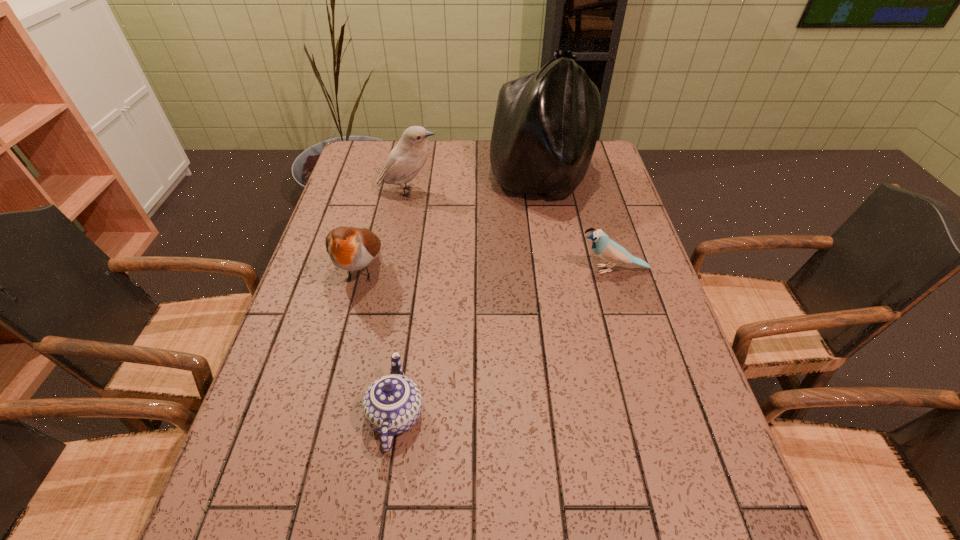
Locate an element on the screen. The height and width of the screenshot is (540, 960). blank region between the farthest bird and the chinaware is located at coordinates (402, 303).

Image resolution: width=960 pixels, height=540 pixels. What are the coordinates of `vacant space that's between the farthest bird and the second shortest bird` in the screenshot? It's located at (385, 231).

Locate an element on the screen. The height and width of the screenshot is (540, 960). vacant space that is in between the plastic bag and the shortest bird is located at coordinates (577, 225).

In order to click on free space between the second tallest bird and the farthest bird in this screenshot , I will do `click(385, 231)`.

This screenshot has width=960, height=540. I want to click on free space that is in between the farthest bird and the chinaware, so click(x=402, y=303).

Identify which object is the closest to the shortest bird. Please provide its 2D coordinates. Your answer should be formatted as a tuple, i.e. [(x, y)], where the tuple contains the x and y coordinates of a point satisfying the conditions above.

[(546, 124)]

In order to click on object that is the closest to the rightmost bird in this screenshot , I will do `click(546, 124)`.

Identify the location of the closest bird relative to the farthest bird. The image size is (960, 540). (350, 248).

Identify the location of bird identified as the third closest to the plastic bag. Image resolution: width=960 pixels, height=540 pixels. (350, 248).

You are a GUI agent. You are given a task and a screenshot of the screen. Output one action in this format:
    pyautogui.click(x=<x>, y=<y>)
    Task: Click on the free space in the image that satisfies the following two spatial constraints: 1. at the beak of the farthest bird; 2. at the spout of the chinaware
    
    Given the screenshot: What is the action you would take?
    pyautogui.click(x=365, y=415)